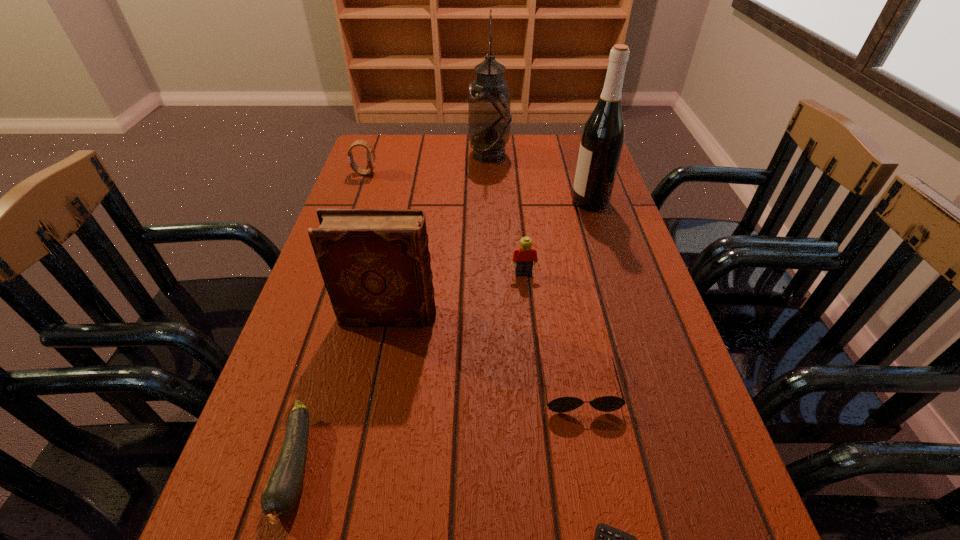
You are a GUI agent. You are given a task and a screenshot of the screen. Output one action in this format:
    pyautogui.click(x=<x>, y=<y>)
    Task: Click on the oil lamp
    
    Given the screenshot: What is the action you would take?
    pyautogui.click(x=489, y=117)

You are a GUI agent. You are given a task and a screenshot of the screen. Output one action in this format:
    pyautogui.click(x=<x>, y=<y>)
    Task: Click on the rightmost object
    This screenshot has width=960, height=540.
    Given the screenshot: What is the action you would take?
    pyautogui.click(x=602, y=140)

Find the location of a particular element. the sixth nearest object is located at coordinates (602, 140).

Where is `hardback book`? hardback book is located at coordinates (375, 263).

Where is `the fourth nearest object`? This screenshot has width=960, height=540. the fourth nearest object is located at coordinates (375, 263).

Find the location of `the seventh nearest object`. the seventh nearest object is located at coordinates pyautogui.click(x=370, y=155).

Locate an element on the screen. The image size is (960, 540). the fifth nearest object is located at coordinates (523, 257).

Image resolution: width=960 pixels, height=540 pixels. In order to click on sunglasses in this screenshot , I will do `click(606, 403)`.

Identify the location of zucchini. (283, 488).

Identify the location of free region located on the right of the oil lamp. tap(551, 154).